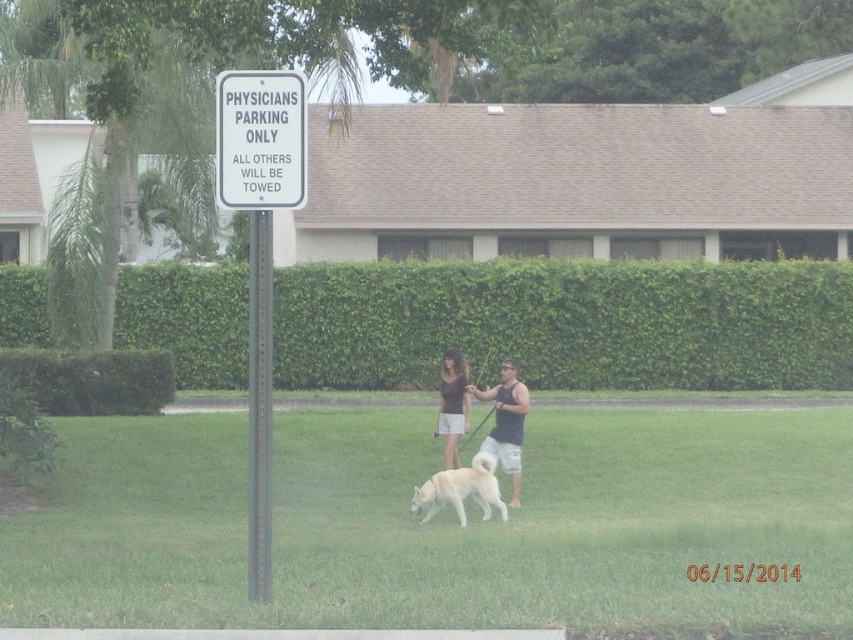
You are standing at the signpost and want to walk towards the point labeled as point (259, 428). Is the point (416, 509) behind or in front of you as you move towards your destination?

The point (416, 509) is behind you as you move towards the point (259, 428) because point (259, 428) is in front of point (416, 509).

You are standing at the camera position and want to call the dog over. Considering the distance between you and the white fur dog at center, will you need to shout to get its attention?

The distance between you and the white fur dog at center is 57.83 feet. Since this is a considerable distance, you would likely need to shout to get its attention.